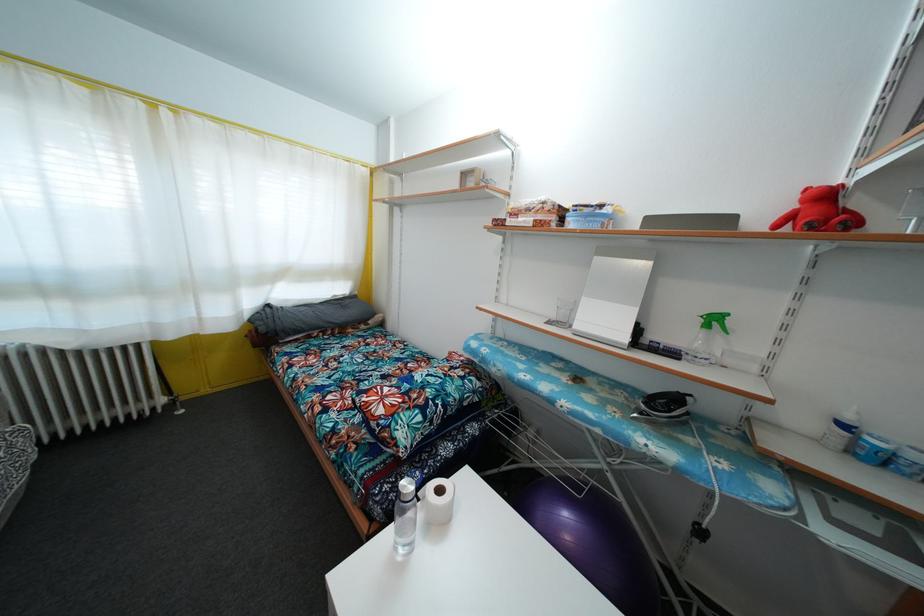
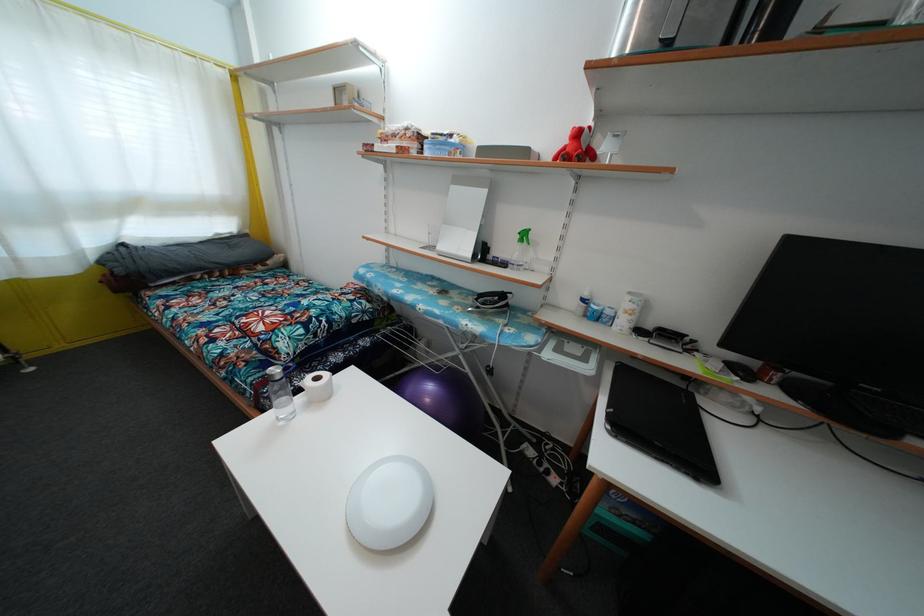
In the second image, find the point that corresponds to pixel 622 398 in the first image.

(475, 304)